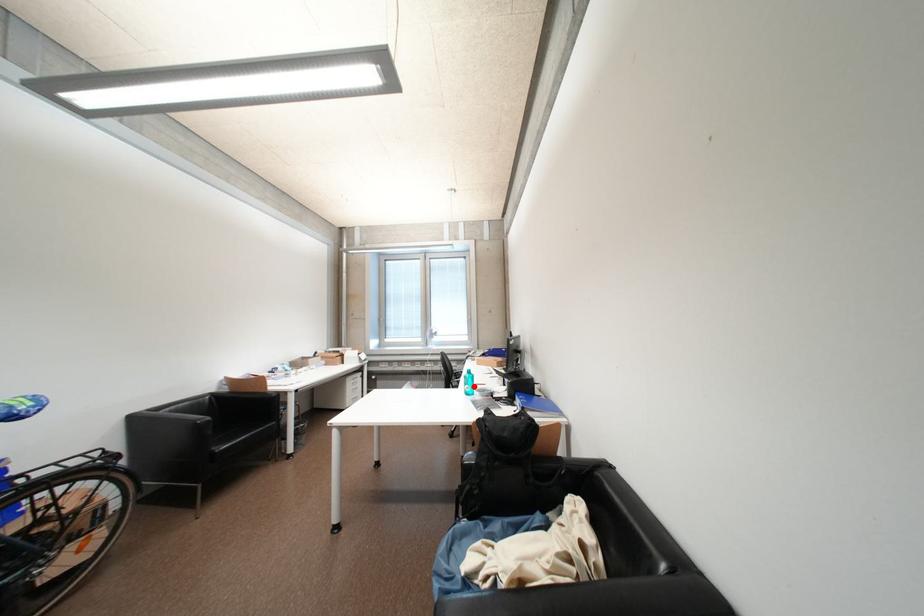
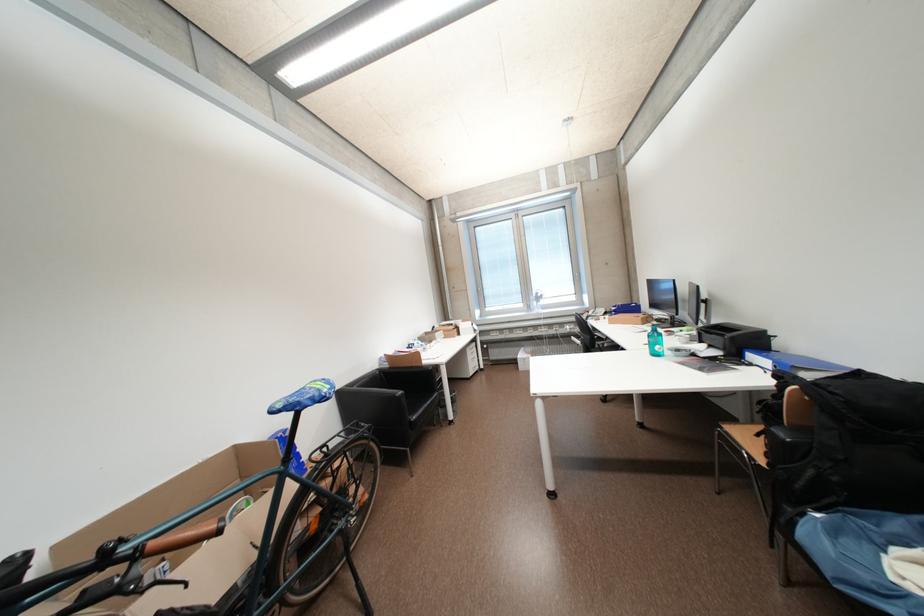
Locate, in the second image, the point that corresponds to the highlighted location in the first image.

(660, 346)